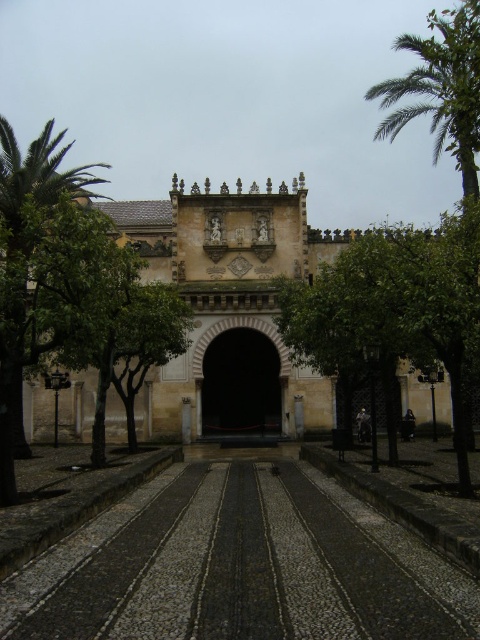
Can you confirm if black textured pavement at center is thinner than green leafy tree at center?

Indeed, black textured pavement at center has a lesser width compared to green leafy tree at center.

Can you confirm if black textured pavement at center is positioned to the left of green leafy tree at center?

Yes, black textured pavement at center is to the left of green leafy tree at center.

Is point (373, 536) closer to viewer compared to point (471, 300)?

That is True.

At what (x,y) coordinates should I click in order to perform the action: click on black textured pavement at center. Please return your answer as a coordinate pair (x, y). Looking at the image, I should click on (240, 566).

Is stone archway at center wider than green leafy tree at center?

Correct, the width of stone archway at center exceeds that of green leafy tree at center.

Consider the image. Does stone archway at center appear on the right side of green leafy tree at center?

In fact, stone archway at center is to the left of green leafy tree at center.

Between point (237, 316) and point (297, 358), which one is positioned behind?

Point (237, 316)

The image size is (480, 640). What are the coordinates of `stone archway at center` in the screenshot? It's located at (229, 305).

Is green leafy tree at center to the left of dark stone archway at center from the viewer's perspective?

In fact, green leafy tree at center is to the right of dark stone archway at center.

Identify the location of green leafy tree at center. This screenshot has height=640, width=480. (394, 307).